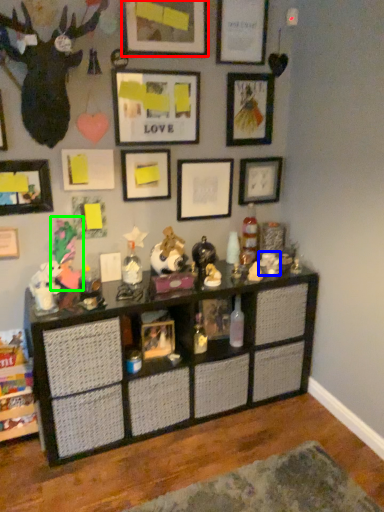
Question: Which is nearer to the picture frame (highlighted by a red box)? toy (highlighted by a blue box) or toy (highlighted by a green box).

Choices:
 (A) toy
 (B) toy

Answer: (B)